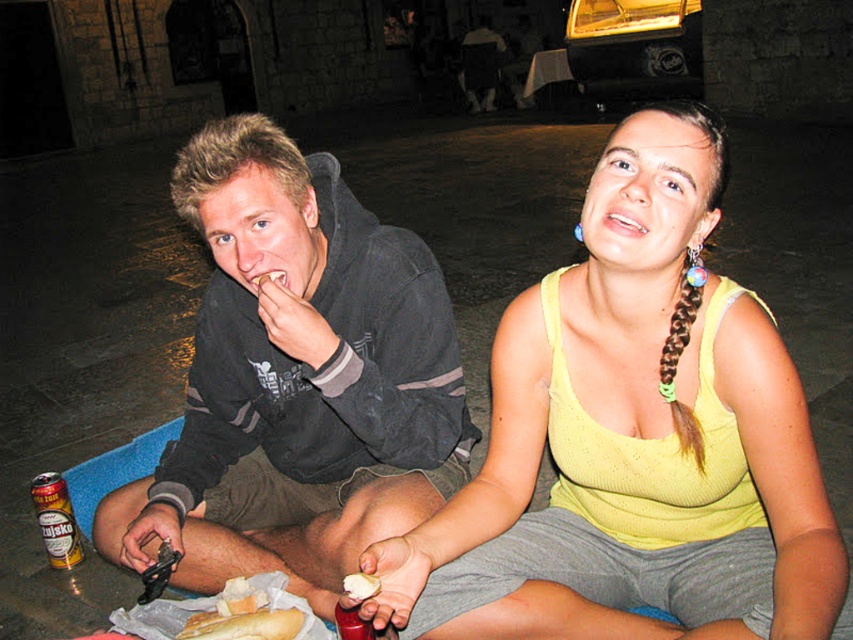
You are a photographer standing at the point with coordinates (297, 378). You want to take a picture of the dark gray hoodie at center. Is the dark gray hoodie at center visible from your current position?

The dark gray hoodie at center is located at point (297, 378), so yes, the photographer can see the dark gray hoodie at center from their current position since they are standing exactly at that point.

You are a photographer trying to capture a closeup of the gold metallic can at lower left without the yellow knitted tank top at center appearing in the frame. Given their sizes, is this possible?

The yellow knitted tank top at center is larger in size than the gold metallic can at lower left. Therefore, it might be challenging to frame the gold metallic can at lower left without including the yellow knitted tank top at center due to its larger size occupying more space in the image.